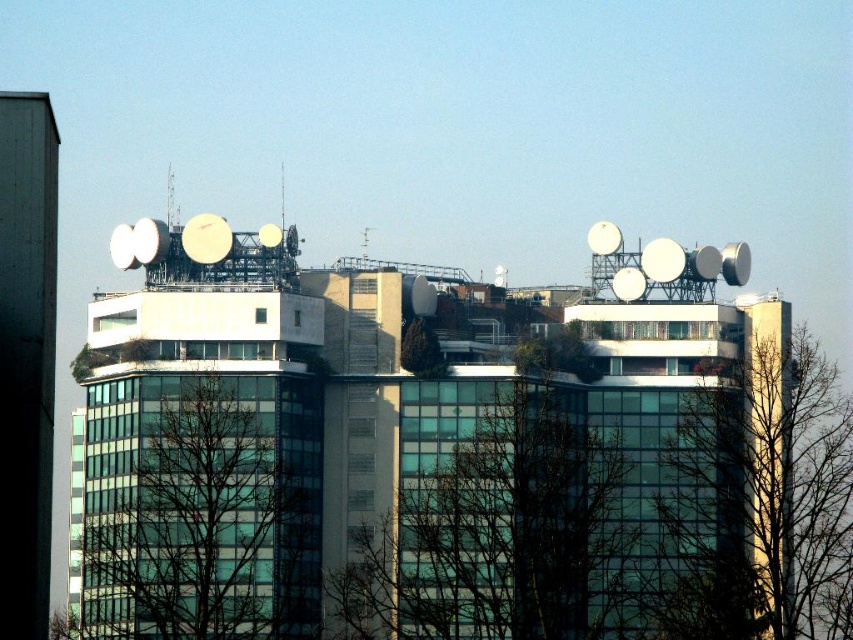
You are standing in front of the building and notice two green leafy trees. Which tree, the green leafy tree at center or the green leafy tree at right, is located more to the right side?

The green leafy tree at right is more to the right side because the green leafy tree at center is positioned on the left side of it.

You are standing at the entrance of the multi story building and want to locate the green leafy tree at center. Based on the 2D coordinates provided, in which direction should you look to find it?

The green leafy tree at center is located at coordinates 0.811 on the x axis and 0.583 on the y axis. Since the x coordinate is closer to 1, the tree is positioned towards the right side of the building.